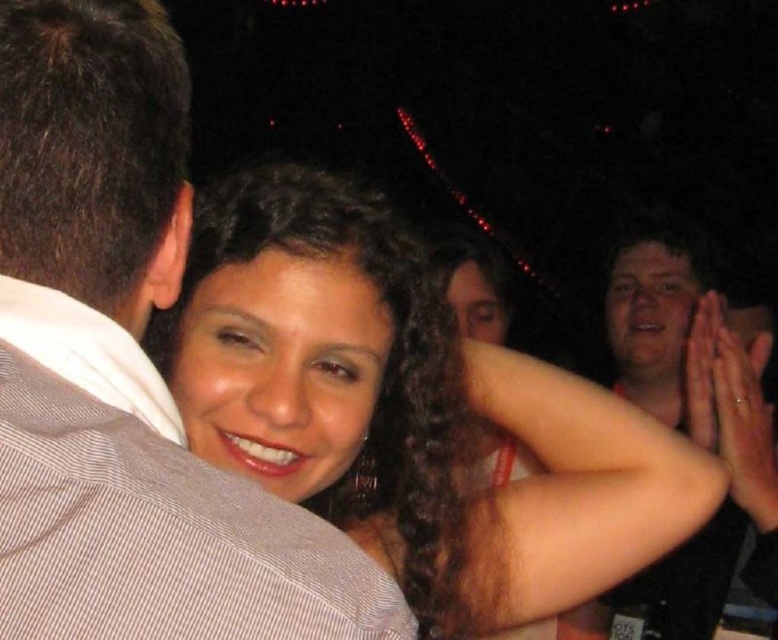
Between white striped shirt at left and matte brown hair at center, which one is positioned lower?

matte brown hair at center is lower down.

Describe the element at coordinates (125, 369) in the screenshot. I see `white striped shirt at left` at that location.

Where is `white striped shirt at left`? Image resolution: width=778 pixels, height=640 pixels. white striped shirt at left is located at coordinates (125, 369).

Is matte brown hair at center positioned at the back of smooth skin hands at right?

No, matte brown hair at center is closer to the viewer.

Does point (503, 536) lie in front of point (668, 256)?

Yes, point (503, 536) is in front of point (668, 256).

Does point (226, 266) come closer to viewer compared to point (678, 241)?

Yes, point (226, 266) is in front of point (678, 241).

The height and width of the screenshot is (640, 778). I want to click on matte brown hair at center, so click(x=407, y=410).

From the picture: Is white striped shirt at left positioned behind smooth skin hands at right?

No, it is in front of smooth skin hands at right.

Between white striped shirt at left and smooth skin hands at right, which one is positioned lower?

white striped shirt at left is lower down.

Where is `white striped shirt at left`? white striped shirt at left is located at coordinates (125, 369).